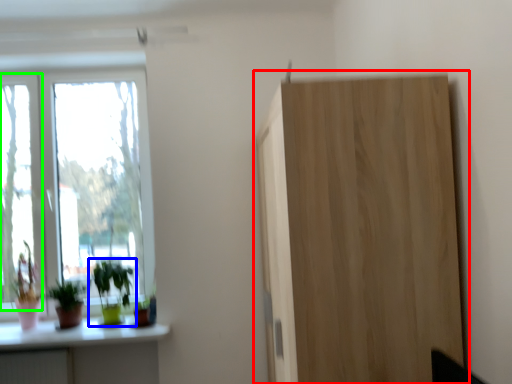
Question: Considering the real-world distances, which object is farthest from cupboard (highlighted by a red box)? houseplant (highlighted by a blue box) or window (highlighted by a green box)?

Choices:
 (A) houseplant
 (B) window

Answer: (B)